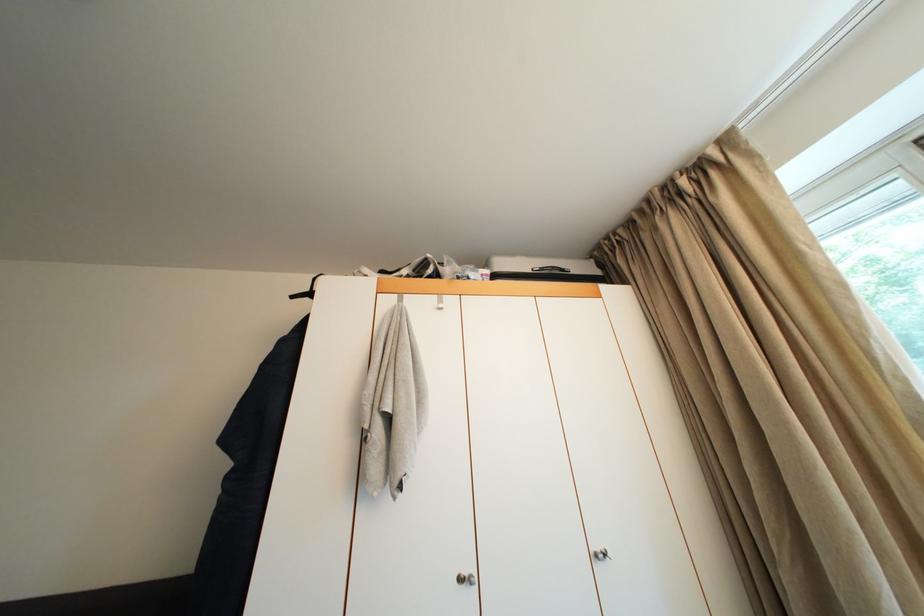
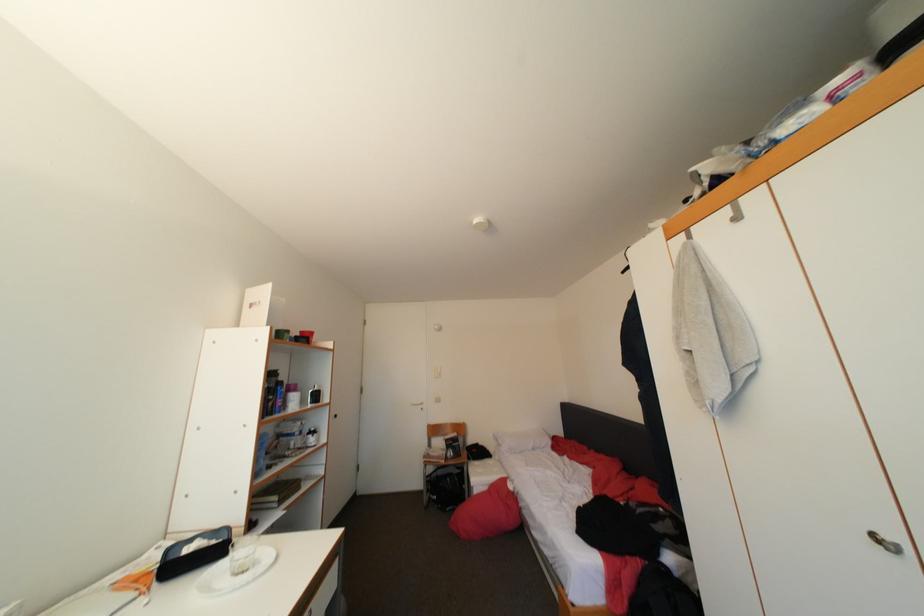
Question: The camera is either moving clockwise (left) or counter-clockwise (right) around the object. The first image is from the beginning of the video and the second image is from the end. Is the camera moving left or right when shooting the video?

Choices:
 (A) Left
 (B) Right

Answer: (B)